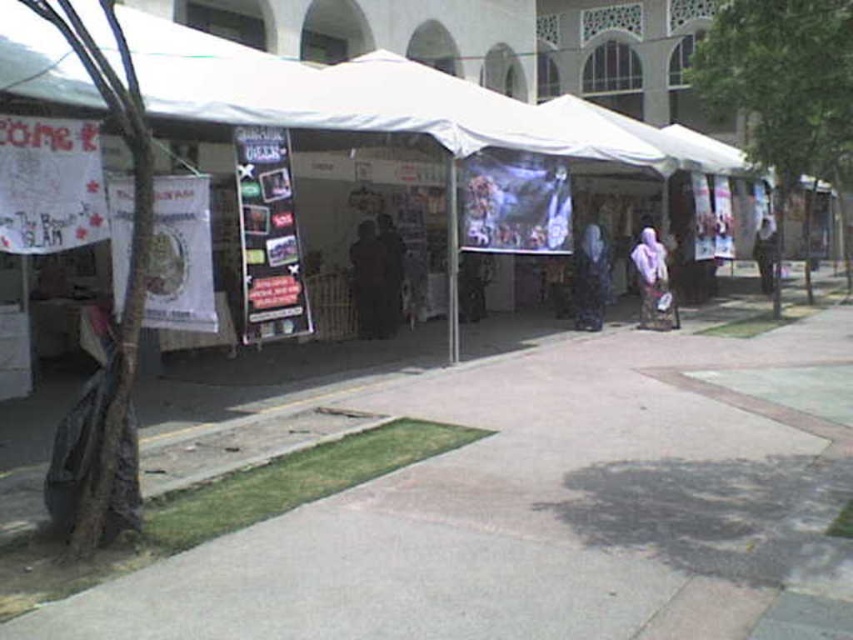
You are a fashion designer attending the outdoor market and see the matte black dress at center and the dark brown leather jacket at center. Which clothing item is shorter in length?

The matte black dress at center is shorter than the dark brown leather jacket at center.

You are at an outdoor market under large white tents. You see a purple fabric at center and a dark brown leather jacket at center. Which item is closer to the ground?

The purple fabric at center is below the dark brown leather jacket at center, so the purple fabric at center is closer to the ground.